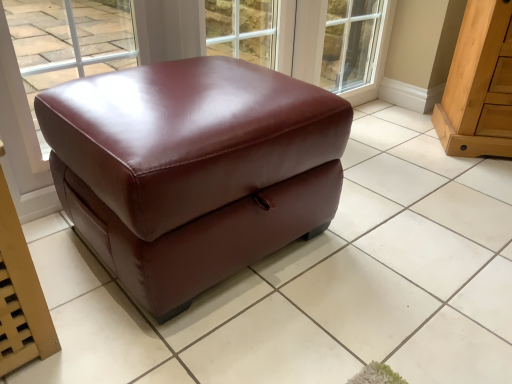
Image resolution: width=512 pixels, height=384 pixels. What are the coordinates of `free space between satin brown leather ottoman at center, the 1th furniture from the left, and light brown wood drawer at right, placed as the 1th furniture when sorted from right to left` in the screenshot? It's located at (400, 181).